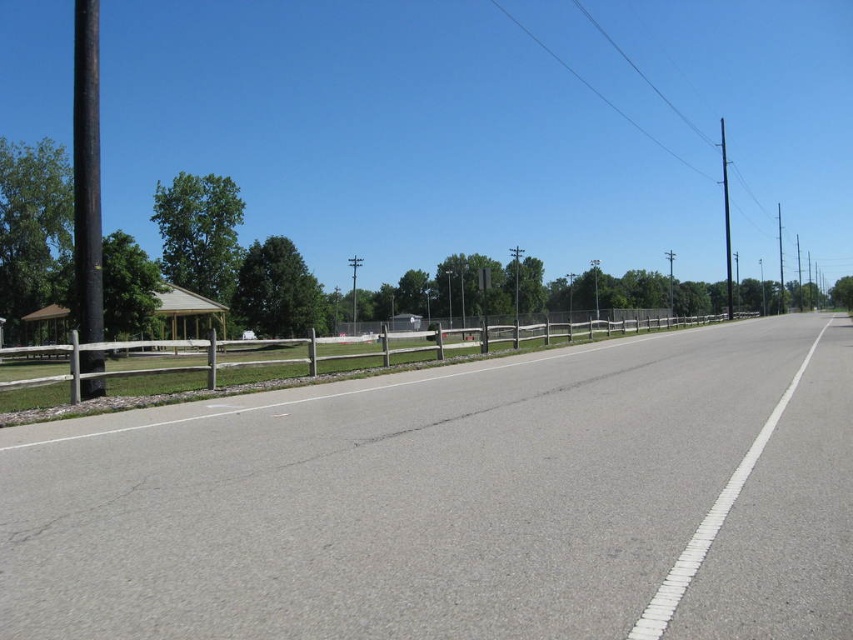
You are standing at the point with coordinates point (781,276) and want to walk to the point with coordinates point (450,499). Which direction should you move relative to the road?

You should move towards the front direction relative to the road because point (450,499) is in front of point (781,276).